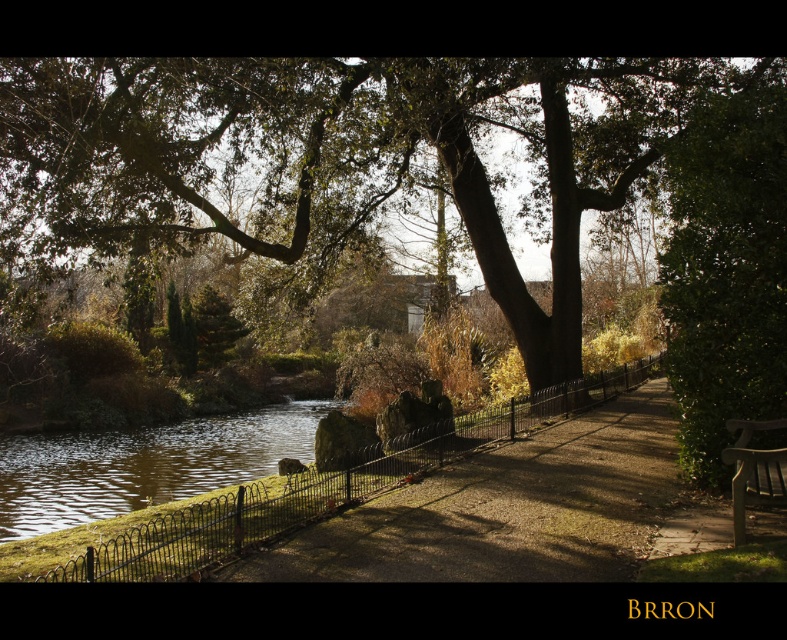
Question: From the image, what is the correct spatial relationship of brown gravel path at center in relation to brown wooden bench at lower right?

Choices:
 (A) right
 (B) left

Answer: (B)

Question: Which point is closer to the camera taking this photo?

Choices:
 (A) (93, 486)
 (B) (478, 188)
 (C) (619, 428)
 (D) (773, 488)

Answer: (D)

Question: Which point is closer to the camera taking this photo?

Choices:
 (A) (17, 442)
 (B) (515, 577)

Answer: (B)

Question: Is brown gravel path at center closer to camera compared to brown wooden bench at lower right?

Choices:
 (A) no
 (B) yes

Answer: (B)

Question: Observing the image, what is the correct spatial positioning of brown gravel path at center in reference to green mossy rock at lower left?

Choices:
 (A) left
 (B) right

Answer: (B)

Question: Among these objects, which one is farthest from the camera?

Choices:
 (A) green mossy rock at lower left
 (B) green leafy tree at center

Answer: (A)